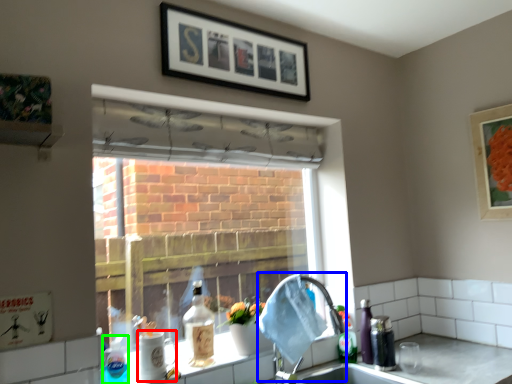
Question: Based on their relative distances, which object is nearer to beverage (highlighted by a red box)? Choose from faucet (highlighted by a blue box) and bottle (highlighted by a green box).

Choices:
 (A) faucet
 (B) bottle

Answer: (B)